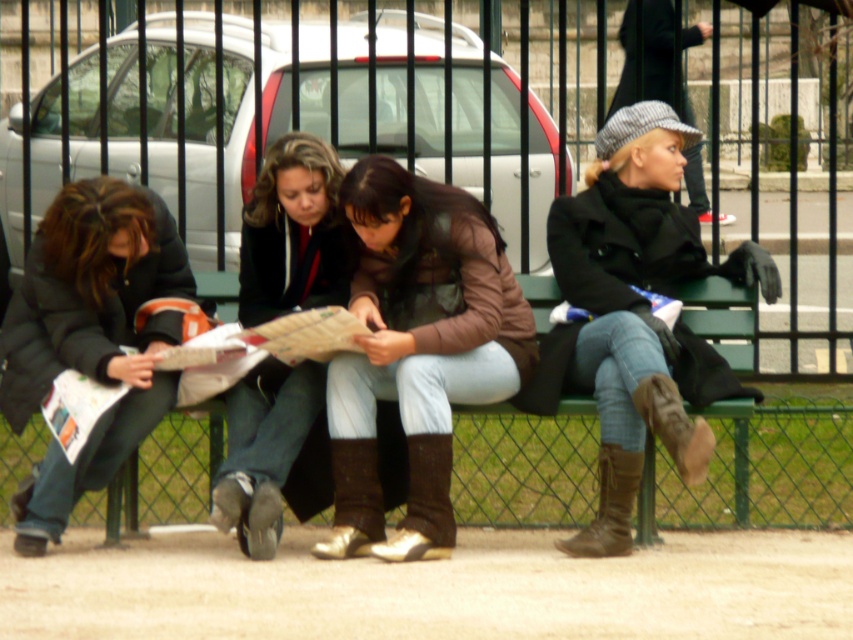
Between point (239, 492) and point (599, 529), which one is positioned behind?

The point (599, 529) is more distant.

In order to click on matte black jacket at center in this screenshot , I will do `click(293, 234)`.

The width and height of the screenshot is (853, 640). What do you see at coordinates (293, 234) in the screenshot? I see `matte black jacket at center` at bounding box center [293, 234].

Where is `matte black jacket at center`? The image size is (853, 640). matte black jacket at center is located at coordinates (293, 234).

Does silver metallic car at center have a smaller size compared to leather brown jacket at center?

Actually, silver metallic car at center might be larger than leather brown jacket at center.

Does point (404, 120) come in front of point (461, 284)?

No, (404, 120) is further to viewer.

Between point (210, 58) and point (421, 260), which one is positioned in front?

Positioned in front is point (421, 260).

Locate an element on the screen. silver metallic car at center is located at coordinates (451, 113).

Does brown leather boots at center have a lesser width compared to matte black jacket at center?

No.

Describe the element at coordinates (635, 305) in the screenshot. This screenshot has width=853, height=640. I see `brown leather boots at center` at that location.

Is point (561, 547) closer to viewer compared to point (329, 200)?

That is True.

At what (x,y) coordinates should I click in order to perform the action: click on brown leather boots at center. Please return your answer as a coordinate pair (x, y). The image size is (853, 640). Looking at the image, I should click on (635, 305).